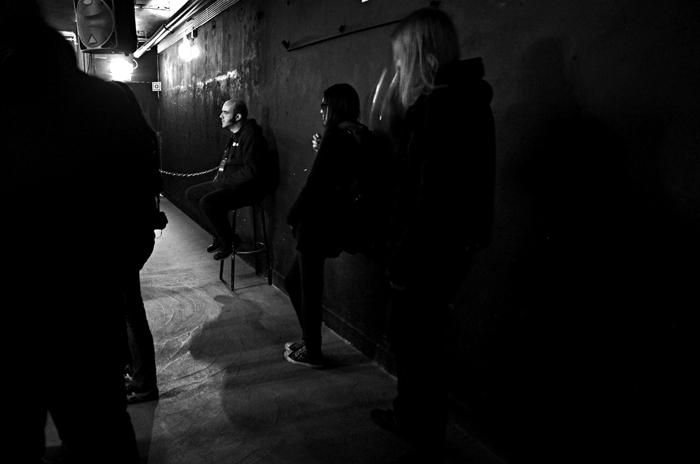
Find the location of a particular element. floor is located at coordinates (195, 407).